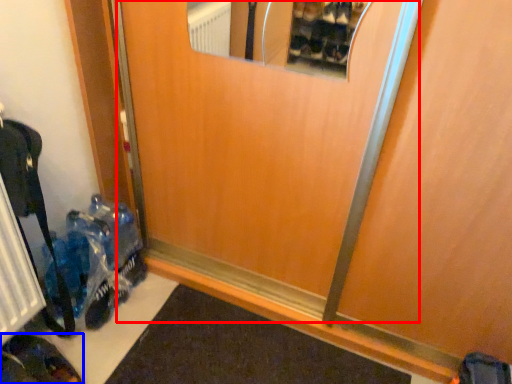
Question: Which object is further to the camera taking this photo, elevator door (highlighted by a red box) or footwear (highlighted by a blue box)?

Choices:
 (A) elevator door
 (B) footwear

Answer: (B)